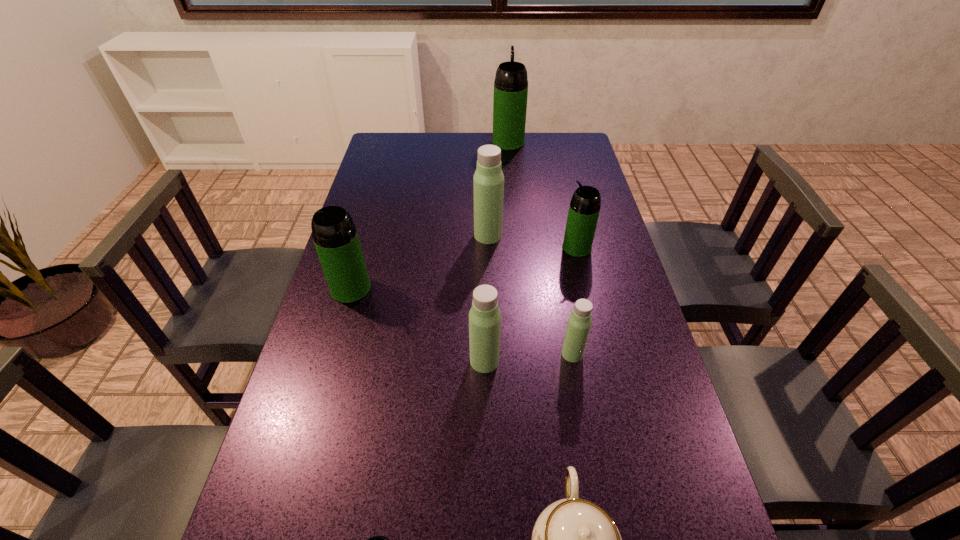
Where is `free space at the far edge of the desktop`? The width and height of the screenshot is (960, 540). free space at the far edge of the desktop is located at coordinates (538, 145).

Identify the location of vacant space at the left edge of the desktop. (372, 190).

In order to click on vacant space at the right edge of the desktop in this screenshot , I will do `click(613, 280)`.

Locate an element on the screen. The image size is (960, 540). vacant space at the far left corner of the desktop is located at coordinates (393, 159).

Where is `vacant space at the far right corner`? The width and height of the screenshot is (960, 540). vacant space at the far right corner is located at coordinates (566, 143).

I want to click on free point between the fourth nearest thermos bottle and the second smallest light thermos bottle, so pos(418,325).

I want to click on free space that is in between the sixth thermos bottle from left to right and the tallest thermos bottle, so click(540, 248).

Locate an element on the screen. Image resolution: width=960 pixels, height=540 pixels. free area in between the tallest thermos bottle and the second smallest green thermos bottle is located at coordinates (542, 195).

This screenshot has width=960, height=540. Identify the location of vacant area that lies between the second biggest light thermos bottle and the leftmost thermos bottle. (418, 325).

Identify the location of object identified as the fourth closest to the second biggest light thermos bottle. (375, 539).